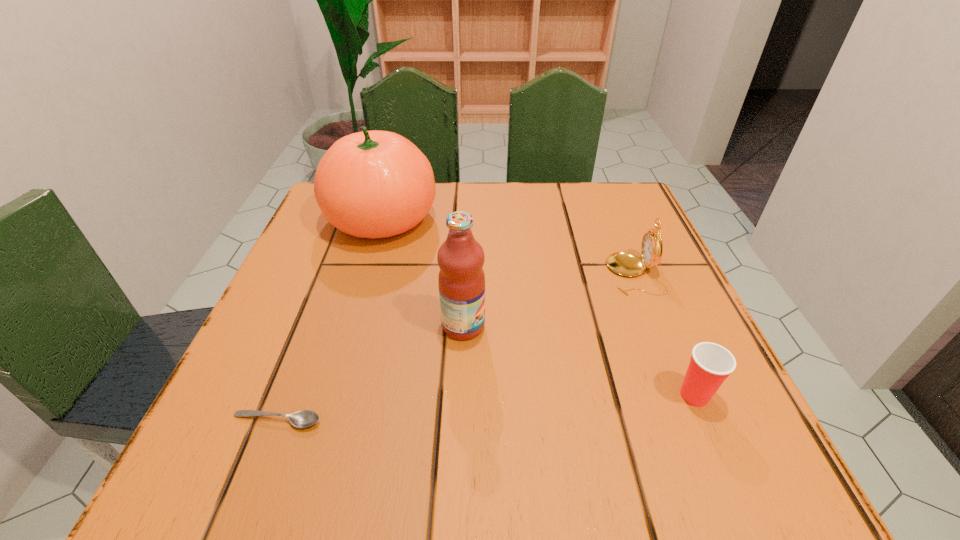
This screenshot has width=960, height=540. I want to click on free space that is in between the pumpkin and the Dixie cup, so click(538, 307).

Identify the location of empty location between the third farthest object and the farthest object. The image size is (960, 540). (422, 272).

Where is `free space that is in between the second shortest object and the pumpkin`? This screenshot has height=540, width=960. free space that is in between the second shortest object and the pumpkin is located at coordinates (538, 307).

In order to click on vacant region between the Dixie cup and the pumpkin in this screenshot , I will do `click(538, 307)`.

Find the location of `vacant space in between the second farthest object and the Dixie cup`. vacant space in between the second farthest object and the Dixie cup is located at coordinates (664, 335).

This screenshot has width=960, height=540. I want to click on free point between the soupspoon and the third shortest object, so click(x=456, y=347).

Where is `unoccupied position between the pumpkin and the Dixie cup`? The image size is (960, 540). unoccupied position between the pumpkin and the Dixie cup is located at coordinates (538, 307).

Where is `vacant area that lies between the second shortest object and the fourth nearest object`? Image resolution: width=960 pixels, height=540 pixels. vacant area that lies between the second shortest object and the fourth nearest object is located at coordinates point(664,335).

Choose which object is the third nearest neighbor to the third nearest object. Please provide its 2D coordinates. Your answer should be formatted as a tuple, i.e. [(x, y)], where the tuple contains the x and y coordinates of a point satisfying the conditions above.

[(626, 264)]

Choose which object is the fourth nearest neighbor to the Dixie cup. Please provide its 2D coordinates. Your answer should be formatted as a tuple, i.e. [(x, y)], where the tuple contains the x and y coordinates of a point satisfying the conditions above.

[(305, 418)]